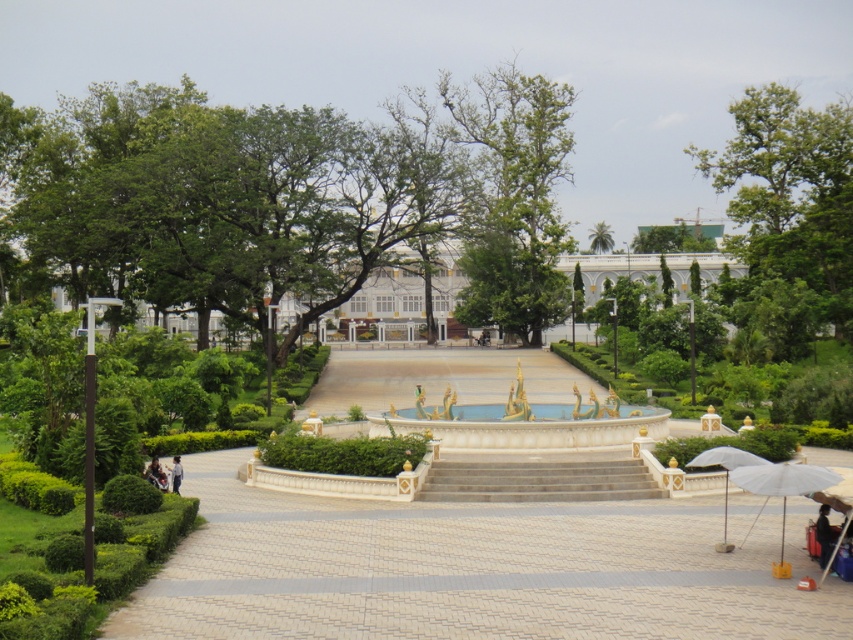
Does green leafy tree at center have a smaller size compared to white matte umbrella at lower right?

No, green leafy tree at center is not smaller than white matte umbrella at lower right.

Find the location of a particular element. This screenshot has height=640, width=853. green leafy tree at center is located at coordinates (514, 198).

Find the location of `green leafy tree at center`. green leafy tree at center is located at coordinates (514, 198).

You are a GUI agent. You are given a task and a screenshot of the screen. Output one action in this format:
    pyautogui.click(x=<x>, y=<y>)
    Task: Click on the smooth stone stairs at center
    
    Given the screenshot: What is the action you would take?
    pyautogui.click(x=538, y=481)

Between smooth stone stairs at center and white fabric umbrella at lower right, which one is positioned higher?

white fabric umbrella at lower right is above.

Does point (630, 481) come farther from viewer compared to point (726, 548)?

Yes, it is.

Locate an element on the screen. smooth stone stairs at center is located at coordinates (538, 481).

Does white matte umbrella at lower right come in front of white fabric umbrella at lower right?

Yes, it is.

Between white matte umbrella at lower right and white fabric umbrella at lower right, which one is positioned lower?

white matte umbrella at lower right is below.

Measure the distance between white matte umbrella at lower right and camera.

white matte umbrella at lower right is 29.99 meters away from camera.

The height and width of the screenshot is (640, 853). In order to click on white matte umbrella at lower right in this screenshot , I will do `click(782, 481)`.